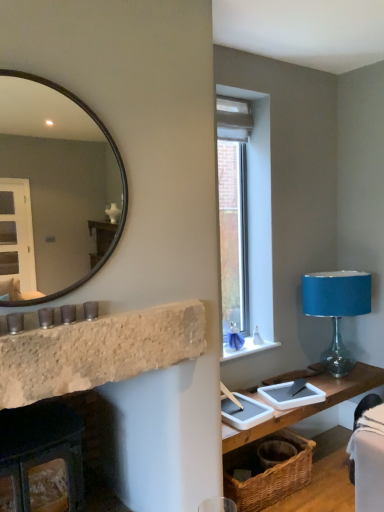
Question: Considering the relative positions of clear glass window at upper right and white stone window sill at center in the image provided, is clear glass window at upper right to the right of white stone window sill at center from the viewer's perspective?

Choices:
 (A) yes
 (B) no

Answer: (B)

Question: Is clear glass window at upper right outside white stone window sill at center?

Choices:
 (A) no
 (B) yes

Answer: (B)

Question: Could white stone window sill at center be considered to be inside clear glass window at upper right?

Choices:
 (A) no
 (B) yes

Answer: (A)

Question: Does clear glass window at upper right have a lesser height compared to white stone window sill at center?

Choices:
 (A) yes
 (B) no

Answer: (B)

Question: Considering the relative sizes of clear glass window at upper right and white stone window sill at center in the image provided, is clear glass window at upper right wider than white stone window sill at center?

Choices:
 (A) yes
 (B) no

Answer: (B)

Question: Does clear glass window at upper right appear on the left side of white stone window sill at center?

Choices:
 (A) yes
 (B) no

Answer: (A)

Question: Is velvet black swivel chair at lower right positioned before rustic stone fireplace at left, the second fireplace when ordered from bottom to top?

Choices:
 (A) yes
 (B) no

Answer: (B)

Question: Can you confirm if velvet black swivel chair at lower right is positioned to the right of rustic stone fireplace at left, which ranks as the first fireplace in top-to-bottom order?

Choices:
 (A) yes
 (B) no

Answer: (A)

Question: From a real-world perspective, is velvet black swivel chair at lower right physically above rustic stone fireplace at left, which ranks as the first fireplace in top-to-bottom order?

Choices:
 (A) no
 (B) yes

Answer: (A)

Question: From a real-world perspective, is velvet black swivel chair at lower right under rustic stone fireplace at left, the second fireplace when ordered from bottom to top?

Choices:
 (A) no
 (B) yes

Answer: (B)

Question: Is velvet black swivel chair at lower right wider than rustic stone fireplace at left, which ranks as the first fireplace in top-to-bottom order?

Choices:
 (A) no
 (B) yes

Answer: (B)

Question: Is velvet black swivel chair at lower right aimed at rustic stone fireplace at left, the second fireplace when ordered from bottom to top?

Choices:
 (A) yes
 (B) no

Answer: (A)

Question: Is woven brown basket at lower right positioned with its back to woven wood table at lower right?

Choices:
 (A) no
 (B) yes

Answer: (A)